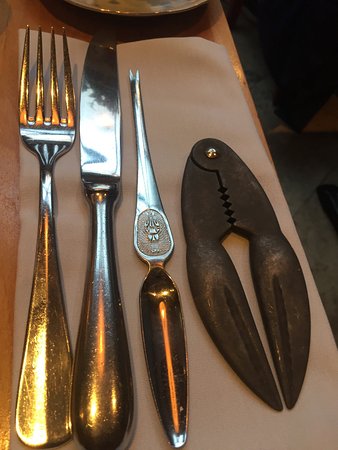
Where is `napkin`? This screenshot has height=450, width=338. napkin is located at coordinates (180, 103).